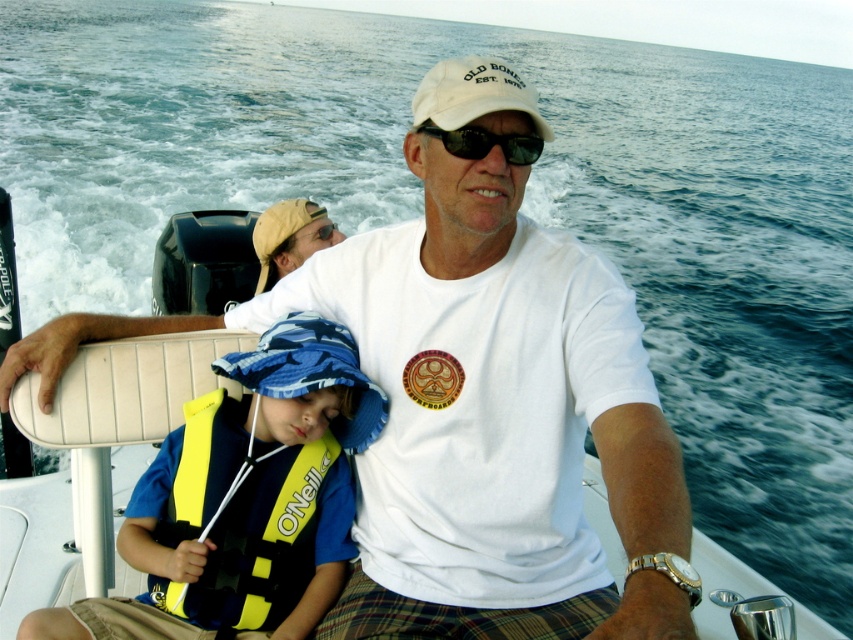
Question: Which point is farther to the camera?

Choices:
 (A) blue fabric baseball hat at center
 (B) black plastic sunglasses at center
 (C) yellow life vest at center
 (D) matte yellow cap at upper center

Answer: (D)

Question: Is yellow life vest at center below matte yellow cap at upper center?

Choices:
 (A) no
 (B) yes

Answer: (B)

Question: In this image, where is yellow fabric life jacket at lower left located relative to black plastic sunglasses at center?

Choices:
 (A) below
 (B) above

Answer: (A)

Question: Is yellow life vest at center to the left of white fabric baseball cap at center from the viewer's perspective?

Choices:
 (A) yes
 (B) no

Answer: (A)

Question: Which point is farther from the camera taking this photo?

Choices:
 (A) (451, 140)
 (B) (489, 84)

Answer: (A)

Question: Based on their relative distances, which object is nearer to the white fabric baseball cap at center?

Choices:
 (A) yellow life vest at center
 (B) blue fabric baseball hat at center
 (C) yellow fabric life jacket at lower left

Answer: (B)